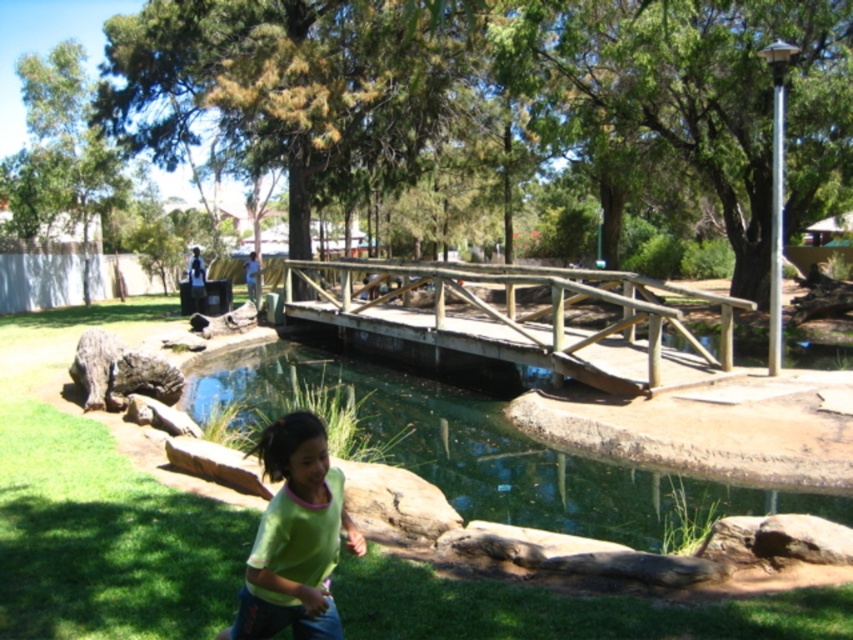
Question: Which object is the farthest from the green matte shirt at lower center?

Choices:
 (A) clear water at bridge center
 (B) wooden bridge at center

Answer: (B)

Question: Considering the relative positions of clear water at bridge center and green matte shirt at lower center in the image provided, where is clear water at bridge center located with respect to green matte shirt at lower center?

Choices:
 (A) right
 (B) left

Answer: (B)

Question: Which of these objects is positioned farthest from the clear water at bridge center?

Choices:
 (A) wooden bridge at center
 (B) green matte shirt at lower center

Answer: (B)

Question: Can you confirm if clear water at bridge center is positioned above wooden bridge at center?

Choices:
 (A) no
 (B) yes

Answer: (A)

Question: Does wooden bridge at center have a greater width compared to green matte shirt at lower center?

Choices:
 (A) yes
 (B) no

Answer: (A)

Question: Which point is closer to the camera?

Choices:
 (A) green matte shirt at lower center
 (B) wooden bridge at center
 (C) clear water at bridge center

Answer: (A)